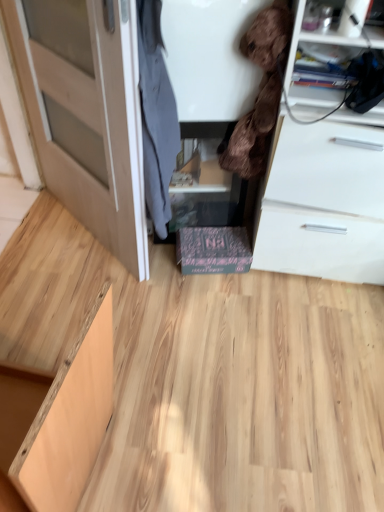
This screenshot has height=512, width=384. Find the location of `free point in front of light brown wood door at left`. free point in front of light brown wood door at left is located at coordinates (85, 296).